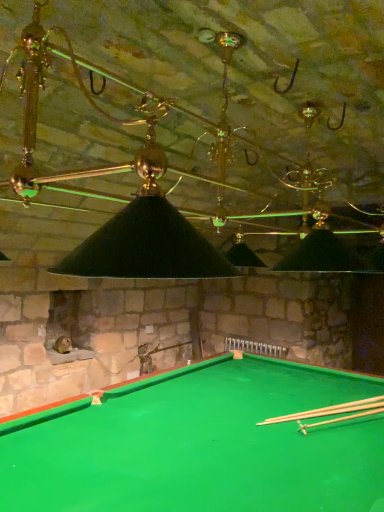
Locate an element on the screen. This screenshot has height=512, width=384. free spot above light brown wooden cue at bottom right (from a real-world perspective) is located at coordinates (351, 403).